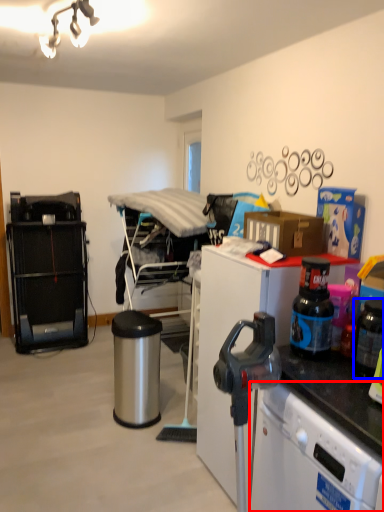
Question: Which point is closer to the camera, dish washer (highlighted by a red box) or appliance (highlighted by a blue box)?

Choices:
 (A) dish washer
 (B) appliance

Answer: (A)